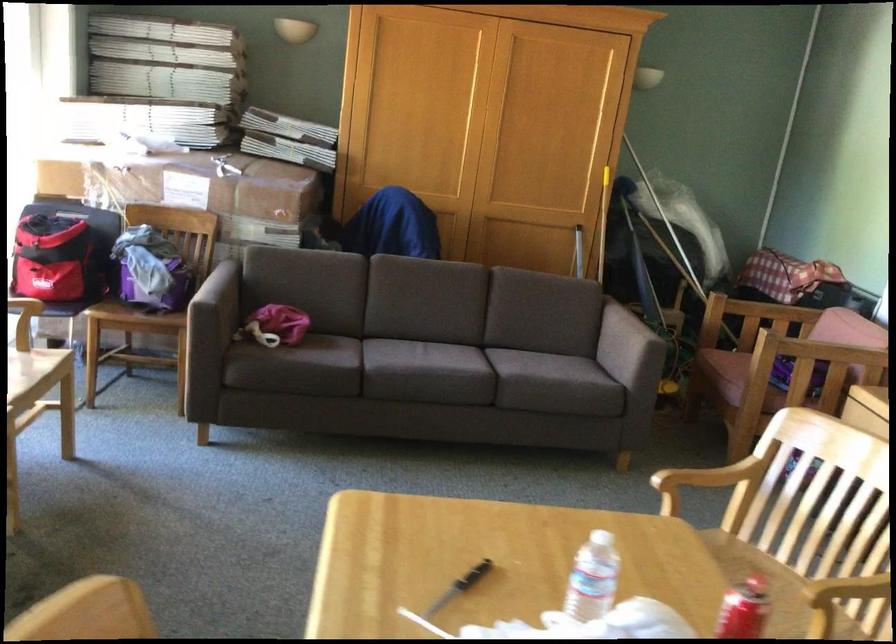
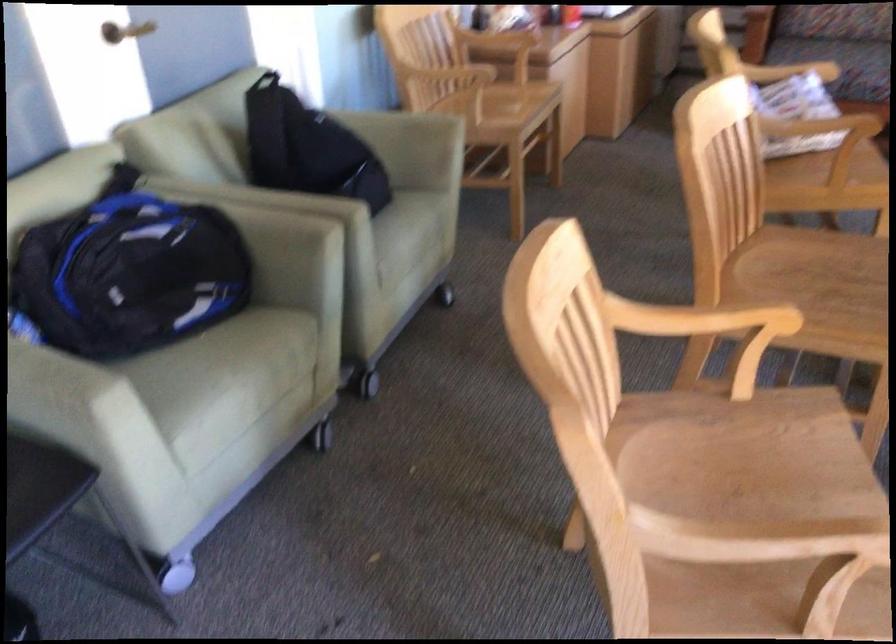
Where in the second image is the point corresponding to pixel 683 468 from the first image?

(760, 538)